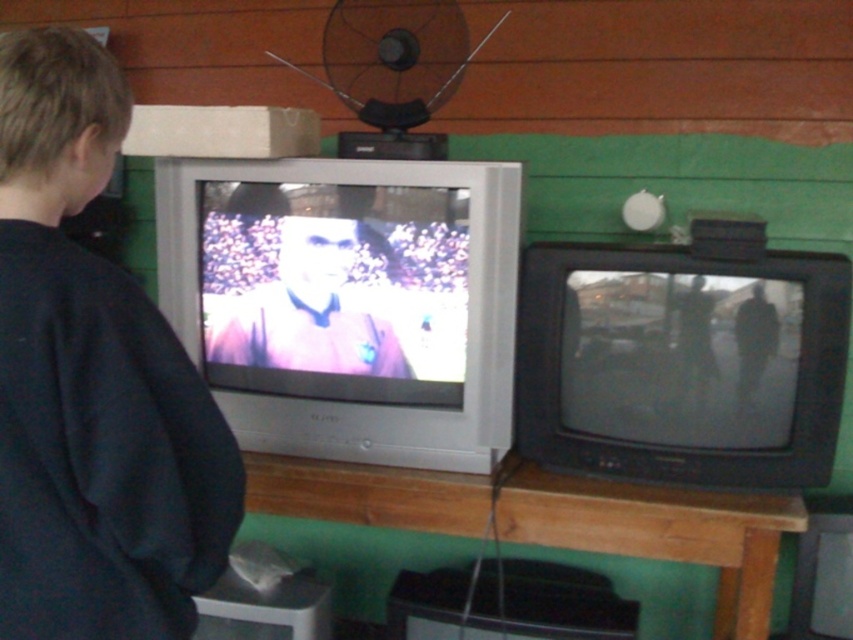
Between point (64, 250) and point (291, 276), which one is positioned behind?

The point (291, 276) is more distant.

Can you confirm if dark blue sweatshirt at left is positioned below matte black shirt at center?

Correct, dark blue sweatshirt at left is located below matte black shirt at center.

The width and height of the screenshot is (853, 640). What do you see at coordinates (91, 381) in the screenshot? I see `dark blue sweatshirt at left` at bounding box center [91, 381].

Where is `dark blue sweatshirt at left`? Image resolution: width=853 pixels, height=640 pixels. dark blue sweatshirt at left is located at coordinates (91, 381).